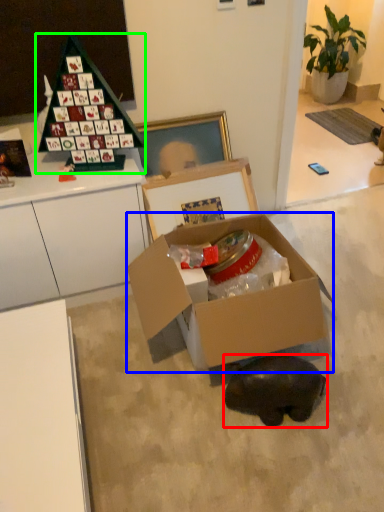
Question: Estimate the real-world distances between objects in this image. Which object is closer to animal (highlighted by a red box), box (highlighted by a blue box) or toy (highlighted by a green box)?

Choices:
 (A) box
 (B) toy

Answer: (A)